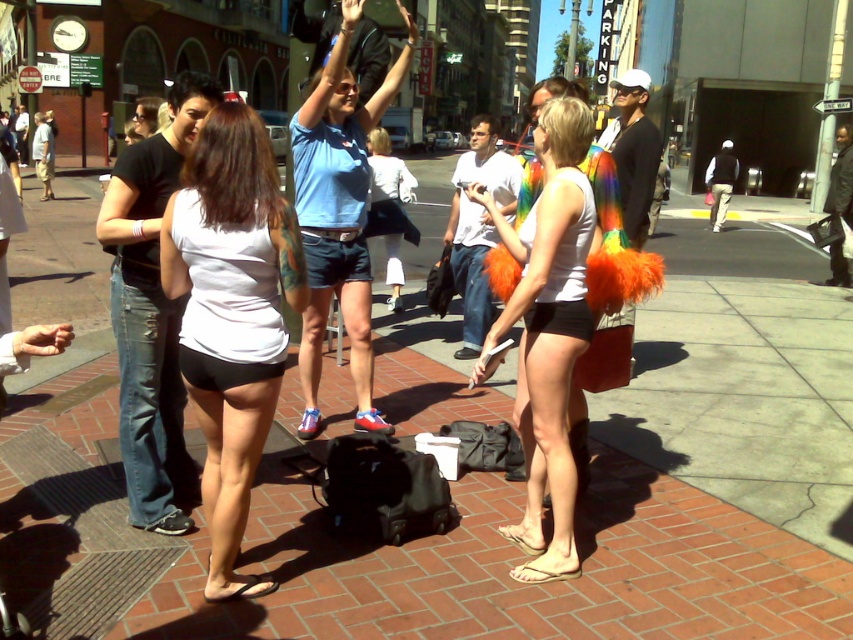
Question: Which of these objects is positioned farthest from the matte blue shirt at center?

Choices:
 (A) white matte shorts at center
 (B) white matte shorts at lower left
 (C) tan leather sandal at lower center

Answer: (C)

Question: Does white matte shorts at center have a greater width compared to tan leather sandal at lower center?

Choices:
 (A) no
 (B) yes

Answer: (B)

Question: Which of the following is the closest to the observer?

Choices:
 (A) white matte shorts at lower left
 (B) white matte shorts at center

Answer: (A)

Question: Can you confirm if white matte shorts at center is positioned to the left of tan leather sandal at lower center?

Choices:
 (A) yes
 (B) no

Answer: (A)

Question: Is the position of matte blue shirt at center less distant than that of tan leather sandal at lower center?

Choices:
 (A) yes
 (B) no

Answer: (A)

Question: Which point is farther to the camera?

Choices:
 (A) 363,403
 (B) 212,278
 (C) 564,573
 (D) 566,417

Answer: (A)